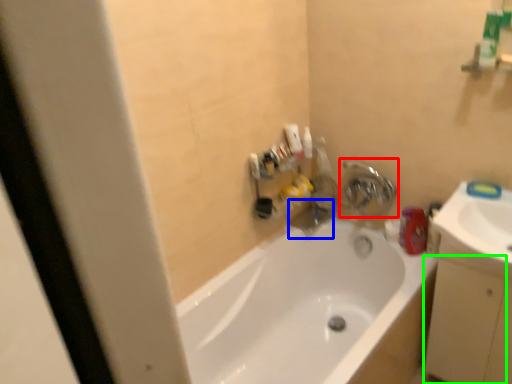
Question: Considering the real-world distances, which object is farthest from tap (highlighted by a red box)? plumbing fixture (highlighted by a blue box) or drawer (highlighted by a green box)?

Choices:
 (A) plumbing fixture
 (B) drawer

Answer: (B)